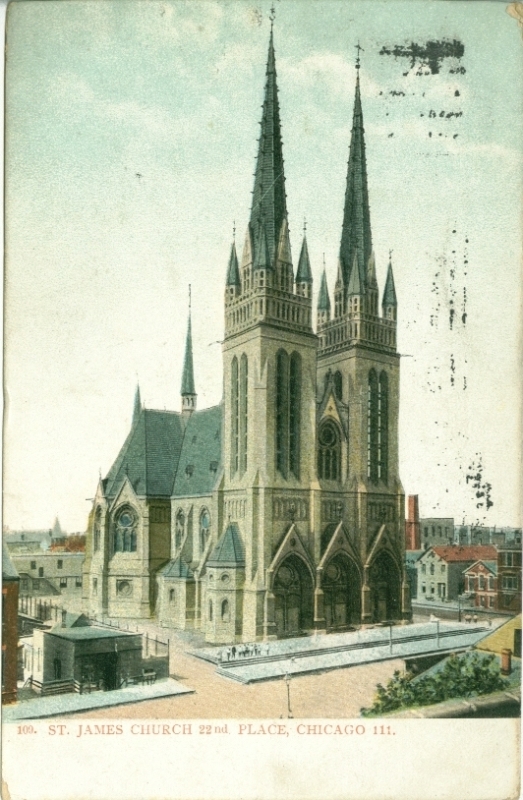
The width and height of the screenshot is (523, 800). I want to click on arched doorway, so click(294, 580).